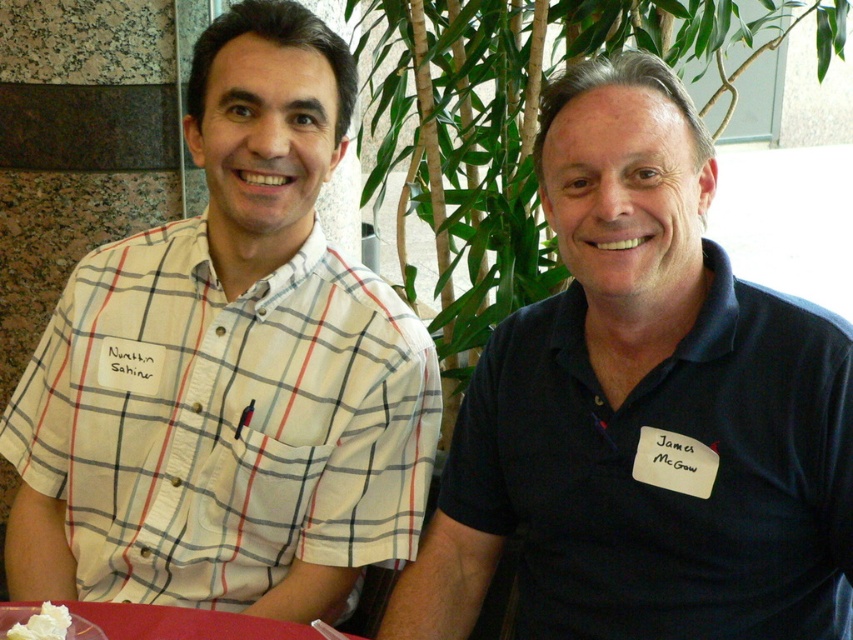
You are a photographer setting up a shot. You want to ensure that both the dark blue polo shirt at right and the smooth plastic table at lower left are in focus. The camera you are using has a depth of field that can cover objects within a 15 inch range. Can both objects be in focus at the same time?

The distance between the dark blue polo shirt at right and the smooth plastic table at lower left is 17.32 inches. Since the depth of field can only cover 15 inches, the two objects are too far apart to be in focus simultaneously.

You are a photographer setting up for a group photo. You notice the white checkered shirt at center and the smooth plastic table at lower left in the frame. Which object should you adjust to ensure both are visible in the photo?

The white checkered shirt at center is taller than the smooth plastic table at lower left, so you should lower the camera angle to include the entire height of the white checkered shirt at center while still capturing the smooth plastic table at lower left in the frame.